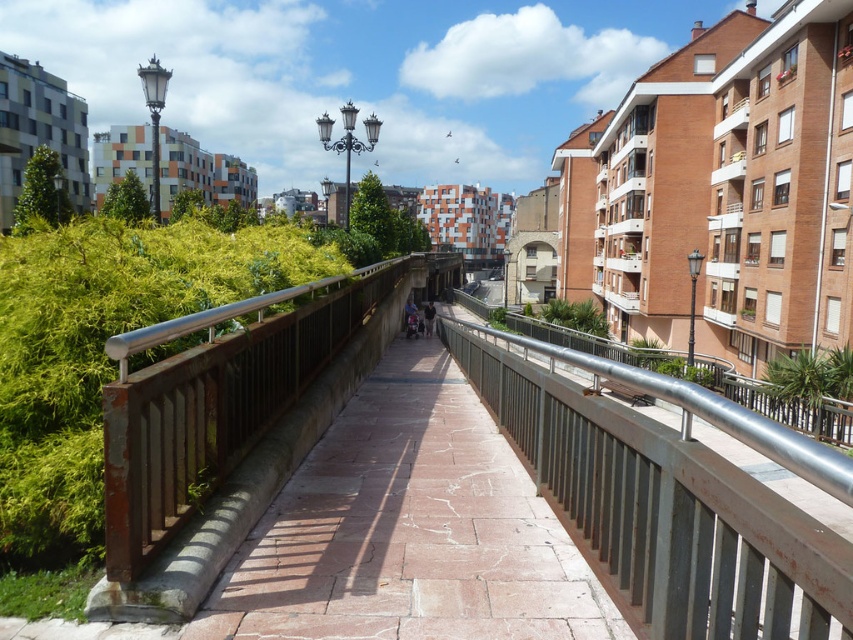
Between metallic silver railing at center and dark gray fabric pants at center, which one has less height?

With less height is metallic silver railing at center.

Which is in front, point (537, 428) or point (426, 333)?

Point (537, 428) is more forward.

The height and width of the screenshot is (640, 853). In order to click on metallic silver railing at center in this screenshot , I will do `click(663, 512)`.

Can you confirm if rustic stone walkway at center is thinner than dark gray fabric pants at center?

No, rustic stone walkway at center is not thinner than dark gray fabric pants at center.

Between rustic stone walkway at center and dark gray fabric pants at center, which one is positioned lower?

rustic stone walkway at center

Which is in front, point (544, 614) or point (422, 312)?

Point (544, 614)

The width and height of the screenshot is (853, 640). What are the coordinates of `rustic stone walkway at center` in the screenshot? It's located at (409, 531).

Can you confirm if metallic silver railing at center is positioned above rusty wood balustrade at center?

Incorrect, metallic silver railing at center is not positioned above rusty wood balustrade at center.

You are a GUI agent. You are given a task and a screenshot of the screen. Output one action in this format:
    pyautogui.click(x=<x>, y=<y>)
    Task: Click on the metallic silver railing at center
    
    Given the screenshot: What is the action you would take?
    pyautogui.click(x=663, y=512)